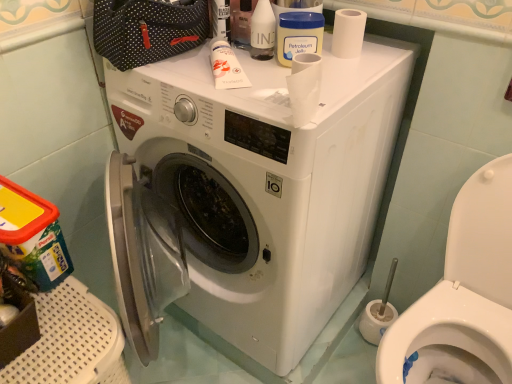
This screenshot has width=512, height=384. I want to click on free space between translucent plastic bottle at upper center, which ranks as the first toiletry in right-to-left order, and white matte tube at upper center, the 1th toiletry ordered from the bottom, so pyautogui.click(x=254, y=65).